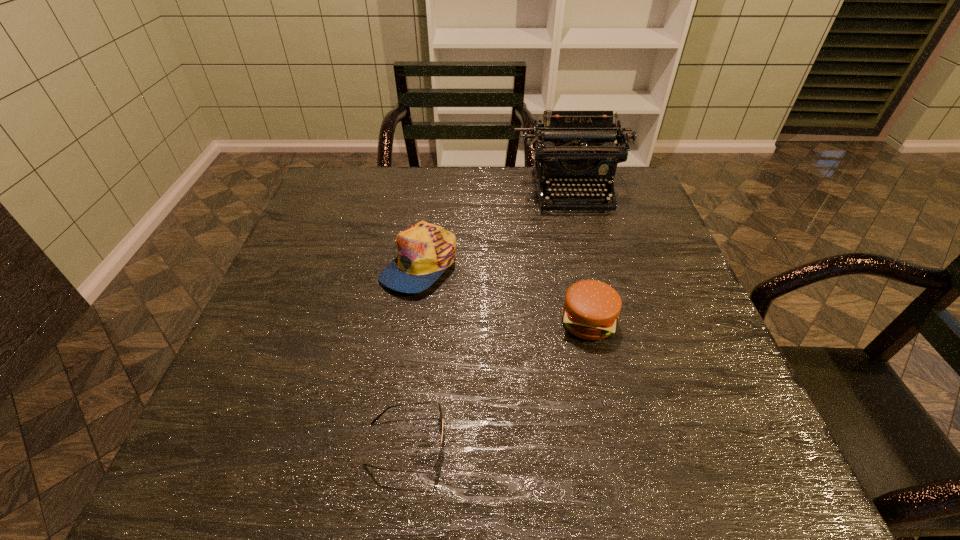
Identify the location of typewriter. The height and width of the screenshot is (540, 960). (570, 147).

Where is `the tallest object`? Image resolution: width=960 pixels, height=540 pixels. the tallest object is located at coordinates (570, 147).

You are a GUI agent. You are given a task and a screenshot of the screen. Output one action in this format:
    pyautogui.click(x=<x>, y=<y>)
    Task: Click on the cap
    The height and width of the screenshot is (540, 960).
    Given the screenshot: What is the action you would take?
    pyautogui.click(x=426, y=250)

This screenshot has height=540, width=960. I want to click on the second tallest object, so click(x=426, y=250).

Image resolution: width=960 pixels, height=540 pixels. In order to click on hamburger in this screenshot , I will do `click(591, 309)`.

Locate an element on the screen. the second shortest object is located at coordinates click(x=591, y=309).

Where is `the nearest object`? the nearest object is located at coordinates (438, 461).

Find the location of a particular element. sunglasses is located at coordinates (438, 461).

The image size is (960, 540). I want to click on vacant region located on the keyboard of the typewriter, so click(589, 259).

The height and width of the screenshot is (540, 960). In order to click on free location located 0.300m on the bill of the cap in this screenshot , I will do `click(396, 425)`.